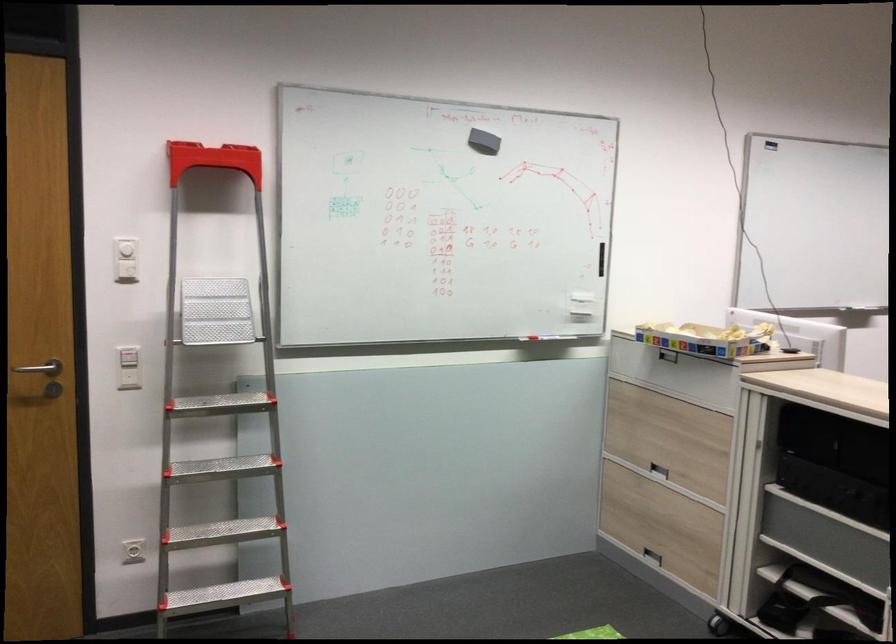
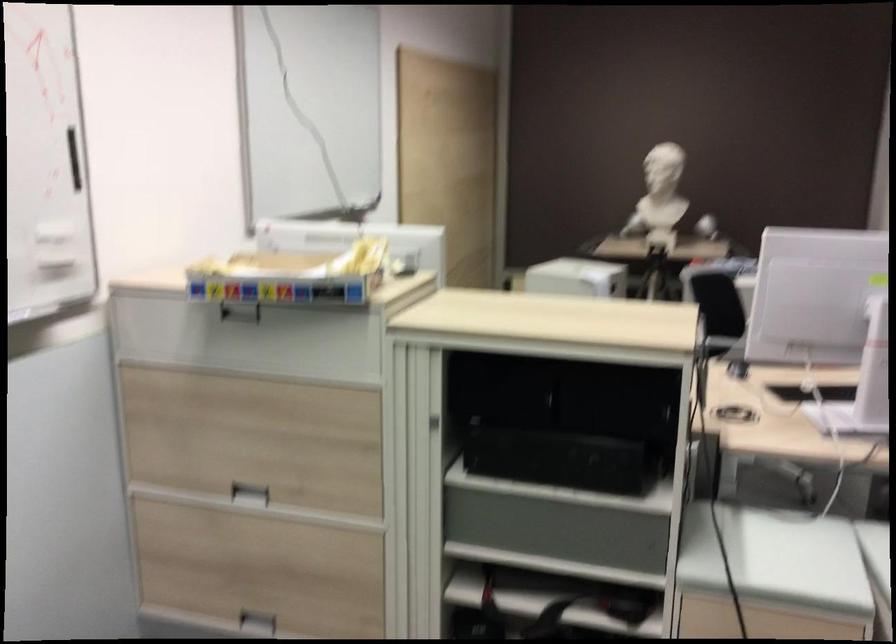
In the second image, find the point that corresponds to (x=648, y=564) in the first image.

(257, 623)